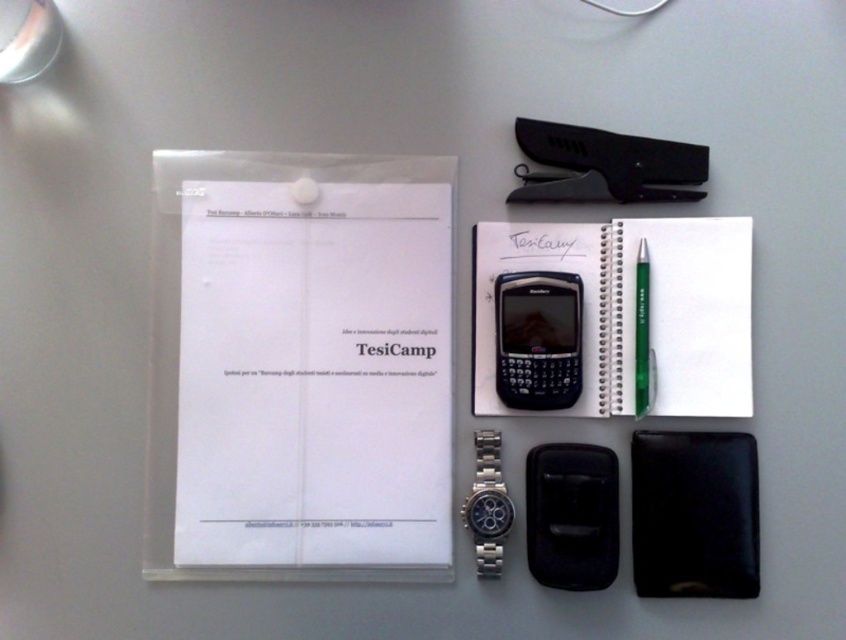
Question: Is spiral-bound paper at center further to camera compared to black plastic clipboard at upper center?

Choices:
 (A) yes
 (B) no

Answer: (A)

Question: Which point is farther from the camera taking this photo?

Choices:
 (A) (570, 129)
 (B) (500, 337)
 (C) (493, 276)
 (D) (743, 484)

Answer: (C)

Question: Does black plastic clipboard at upper center have a greater width compared to black plastic smartphone at center?

Choices:
 (A) yes
 (B) no

Answer: (A)

Question: Among these objects, which one is nearest to the camera?

Choices:
 (A) black plastic clipboard at upper center
 (B) green plastic pen at center right
 (C) black plastic smartphone at center

Answer: (C)

Question: Which point appears farthest from the camera in this image?

Choices:
 (A) (575, 291)
 (B) (634, 189)
 (C) (691, 476)

Answer: (B)

Question: Is black plastic smartphone at center thinner than green plastic pen at center right?

Choices:
 (A) yes
 (B) no

Answer: (B)